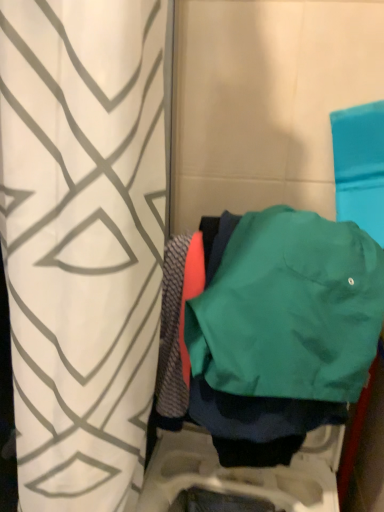
What do you see at coordinates (288, 308) in the screenshot? I see `green fabric jacket at center` at bounding box center [288, 308].

Image resolution: width=384 pixels, height=512 pixels. What are the coordinates of `green fabric jacket at center` in the screenshot? It's located at (288, 308).

Where is `white geometric-patterned curtain at center`? white geometric-patterned curtain at center is located at coordinates (83, 240).

Measure the distance between white geometric-patterned curtain at center and camera.

A distance of 15.91 inches exists between white geometric-patterned curtain at center and camera.

Describe the element at coordinates (83, 240) in the screenshot. I see `white geometric-patterned curtain at center` at that location.

The height and width of the screenshot is (512, 384). Identify the location of green fabric jacket at center. (288, 308).

Which object is positioned more to the left, green fabric jacket at center or white geometric-patterned curtain at center?

white geometric-patterned curtain at center.

Looking at this image, is green fabric jacket at center closer to camera compared to white geometric-patterned curtain at center?

That is False.

Is point (272, 250) less distant than point (94, 132)?

That is False.

From the image's perspective, which one is positioned lower, green fabric jacket at center or white geometric-patterned curtain at center?

white geometric-patterned curtain at center appears lower in the image.

From a real-world perspective, is green fabric jacket at center positioned under white geometric-patterned curtain at center based on gravity?

No.

Looking at this image, between green fabric jacket at center and white geometric-patterned curtain at center, which one has larger width?

With larger width is white geometric-patterned curtain at center.

Between green fabric jacket at center and white geometric-patterned curtain at center, which one has less height?

green fabric jacket at center.

Considering the relative sizes of green fabric jacket at center and white geometric-patterned curtain at center in the image provided, is green fabric jacket at center smaller than white geometric-patterned curtain at center?

Yes.

Do you think green fabric jacket at center is within white geometric-patterned curtain at center, or outside of it?

green fabric jacket at center is not inside white geometric-patterned curtain at center, it's outside.

Is green fabric jacket at center placed right next to white geometric-patterned curtain at center?

No, green fabric jacket at center is not with white geometric-patterned curtain at center.

Is green fabric jacket at center oriented away from white geometric-patterned curtain at center?

green fabric jacket at center does not have its back to white geometric-patterned curtain at center.

Where is `jacket on the right of white geometric-patterned curtain at center`? jacket on the right of white geometric-patterned curtain at center is located at coordinates (288, 308).

Considering the positions of objects white geometric-patterned curtain at center and green fabric jacket at center in the image provided, who is more to the right, white geometric-patterned curtain at center or green fabric jacket at center?

green fabric jacket at center is more to the right.

Does white geometric-patterned curtain at center come behind green fabric jacket at center?

That is False.

Considering the positions of points (146, 138) and (367, 319), is point (146, 138) farther from camera compared to point (367, 319)?

No, it is in front of (367, 319).

From the image's perspective, is white geometric-patterned curtain at center beneath green fabric jacket at center?

Correct, white geometric-patterned curtain at center appears lower than green fabric jacket at center in the image.

From a real-world perspective, which is physically below, white geometric-patterned curtain at center or green fabric jacket at center?

In real-world perspective, white geometric-patterned curtain at center is lower.

Which of these two, white geometric-patterned curtain at center or green fabric jacket at center, is thinner?

green fabric jacket at center is thinner.

From the picture: Considering the sizes of white geometric-patterned curtain at center and green fabric jacket at center in the image, is white geometric-patterned curtain at center taller or shorter than green fabric jacket at center?

In the image, white geometric-patterned curtain at center appears to be taller than green fabric jacket at center.

Based on their sizes in the image, would you say white geometric-patterned curtain at center is bigger or smaller than green fabric jacket at center?

white geometric-patterned curtain at center is bigger than green fabric jacket at center.

Is white geometric-patterned curtain at center situated inside green fabric jacket at center or outside?

white geometric-patterned curtain at center lies outside green fabric jacket at center.

Are white geometric-patterned curtain at center and green fabric jacket at center making contact?

No, white geometric-patterned curtain at center is not making contact with green fabric jacket at center.

Is white geometric-patterned curtain at center facing away from green fabric jacket at center?

Yes, white geometric-patterned curtain at center is facing away from green fabric jacket at center.

How distant is white geometric-patterned curtain at center from green fabric jacket at center?

23.53 centimeters.

In the image, there is a green fabric jacket at center. Where is `curtain below it (from the image's perspective)`? The image size is (384, 512). curtain below it (from the image's perspective) is located at coordinates (83, 240).

Where is `jacket on the right of white geometric-patterned curtain at center`? This screenshot has width=384, height=512. jacket on the right of white geometric-patterned curtain at center is located at coordinates point(288,308).

Where is `jacket above the white geometric-patterned curtain at center (from the image's perspective)`? jacket above the white geometric-patterned curtain at center (from the image's perspective) is located at coordinates (288, 308).